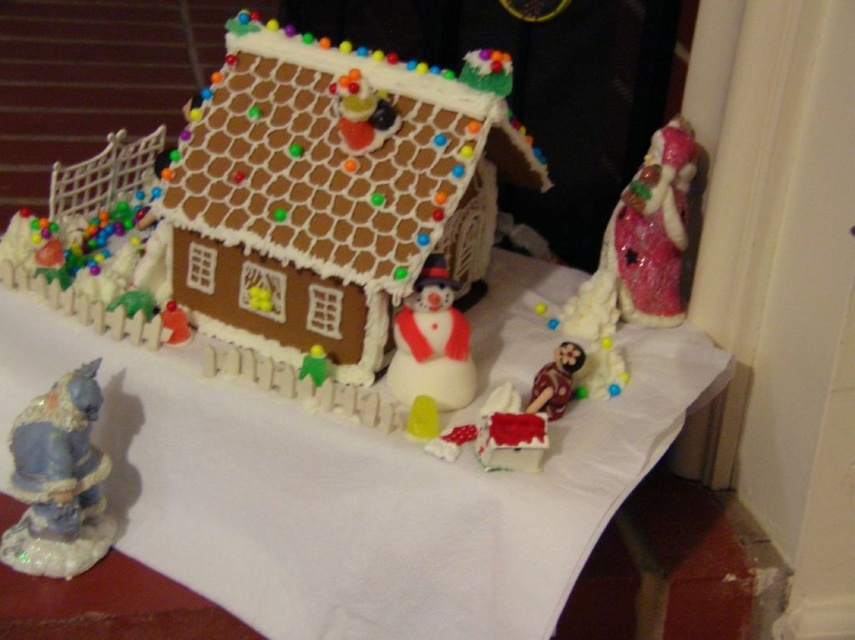
Consider the image. Can you confirm if brown fondant house at center is smaller than matte blue cat at lower left?

Actually, brown fondant house at center might be larger than matte blue cat at lower left.

Who is taller, brown fondant house at center or matte blue cat at lower left?

With more height is brown fondant house at center.

Which is in front, point (251, 93) or point (27, 499)?

Point (27, 499)

Find the location of a particular element. Image resolution: width=855 pixels, height=640 pixels. brown fondant house at center is located at coordinates (296, 221).

The image size is (855, 640). Find the location of `white paper at center`. white paper at center is located at coordinates (351, 488).

Is white paper at center closer to the viewer compared to matte blue cat at lower left?

Yes, it is.

Is point (33, 348) in front of point (93, 536)?

No, it is behind (93, 536).

I want to click on white paper at center, so click(351, 488).

Who is lower down, matte blue cat at lower left or white matte snowman at center?

matte blue cat at lower left

The height and width of the screenshot is (640, 855). Describe the element at coordinates (57, 481) in the screenshot. I see `matte blue cat at lower left` at that location.

Where is `matte blue cat at lower left`? The width and height of the screenshot is (855, 640). matte blue cat at lower left is located at coordinates (57, 481).